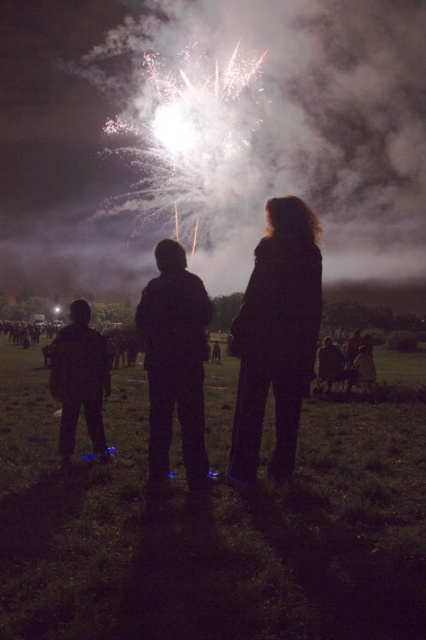
You are standing in the nighttime scene with the three figures watching fireworks. You notice a specific point at coordinates point (209, 528). Based on the scene description, what object is this point located on?

The point (209, 528) is located on the black fabric pants at lower center.

You are standing at the point labeled point (104, 381) and want to move towards the fireworks display. Is the point labeled point (163, 497) between you and the fireworks?

Yes, the point labeled point (163, 497) is between you and the fireworks display because it is in front of point (104, 381) where you are standing.

You are a photographer trying to capture the fireworks display. You notice the black fabric pants at lower center and the black matte jacket at center in your frame. Which clothing item is positioned to the right of the other?

The black fabric pants at lower center is positioned on the right side of black matte jacket at center.